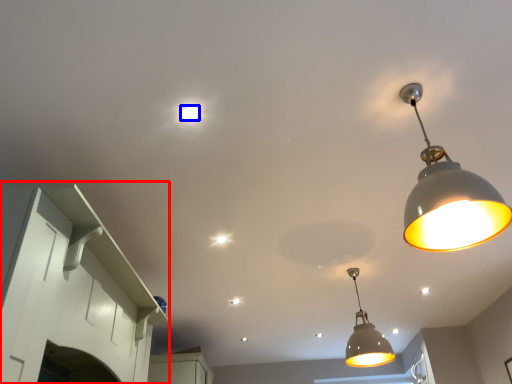
Question: Which object appears farthest to the camera in this image, cabinetry (highlighted by a red box) or light bulb (highlighted by a blue box)?

Choices:
 (A) cabinetry
 (B) light bulb

Answer: (B)